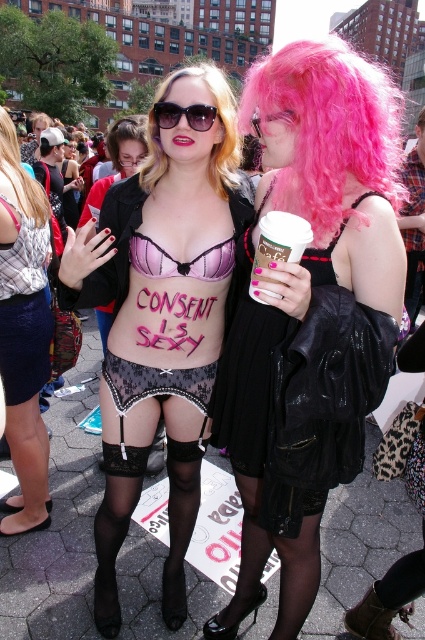
Based on the scene description, where is the matte black shorts at lower left in relation to the blondehair at upper left?

The matte black shorts at lower left is positioned under blondehair at upper left.